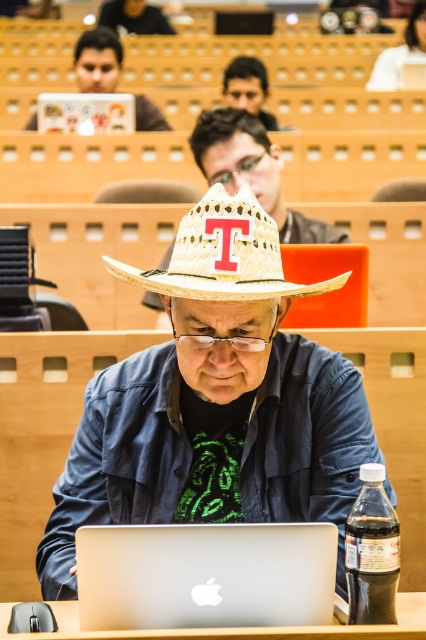
Question: Which point appears closest to the camera in this image?

Choices:
 (A) (242, 74)
 (B) (164, 548)
 (C) (337, 356)
 (D) (72, 602)

Answer: (B)

Question: Does silver metallic table at lower center have a lesser width compared to matte brown hat at upper center?

Choices:
 (A) no
 (B) yes

Answer: (A)

Question: Which point is farther from the camera taking this photo?

Choices:
 (A) (104, 604)
 (B) (279, 406)

Answer: (B)

Question: Is silver metallic table at lower center positioned at the back of matte black laptop at upper left?

Choices:
 (A) no
 (B) yes

Answer: (A)

Question: Which point is closer to the camera?

Choices:
 (A) straw hat at center
 (B) silver metallic table at lower center

Answer: (B)

Question: Is white woven straw hat at center positioned before matte black laptop at upper left?

Choices:
 (A) no
 (B) yes

Answer: (B)